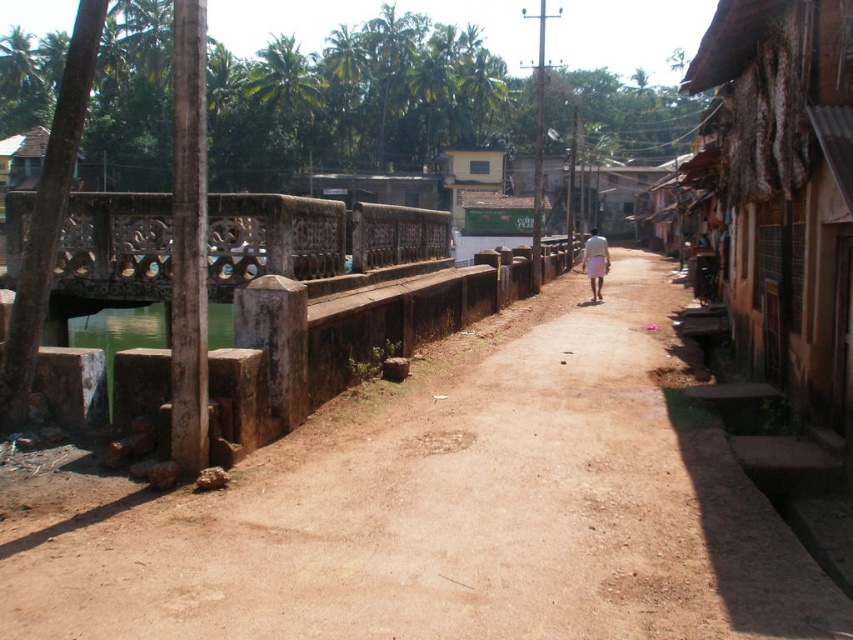
Can you confirm if brown dirt path at center is positioned above rusty corrugated tin hut at right?

Incorrect, brown dirt path at center is not positioned above rusty corrugated tin hut at right.

Is brown dirt path at center in front of rusty corrugated tin hut at right?

Yes, it is in front of rusty corrugated tin hut at right.

I want to click on brown dirt path at center, so click(448, 513).

This screenshot has height=640, width=853. I want to click on brown dirt path at center, so click(x=448, y=513).

Who is more forward, (387, 468) or (224, 266)?

Point (387, 468) is more forward.

Describe the element at coordinates (448, 513) in the screenshot. This screenshot has width=853, height=640. I see `brown dirt path at center` at that location.

Between point (602, 307) and point (352, 216), which one is positioned in front?

Positioned in front is point (352, 216).

Locate an element on the screen. The height and width of the screenshot is (640, 853). brown dirt path at center is located at coordinates (448, 513).

Can you confirm if carved stone bridge at left is smaller than white cotton pants at center?

Yes.

Between carved stone bridge at left and white cotton pants at center, which one has more height?

white cotton pants at center

Is point (373, 248) in front of point (593, 285)?

Yes, it is.

This screenshot has height=640, width=853. Find the location of `carved stone bridge at left`. carved stone bridge at left is located at coordinates (312, 237).